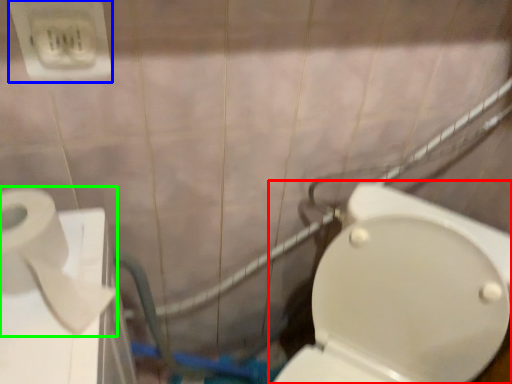
Question: Based on their relative distances, which object is nearer to toilet (highlighted by a red box)? Choose from electric outlet (highlighted by a blue box) and toilet paper (highlighted by a green box).

Choices:
 (A) electric outlet
 (B) toilet paper

Answer: (B)